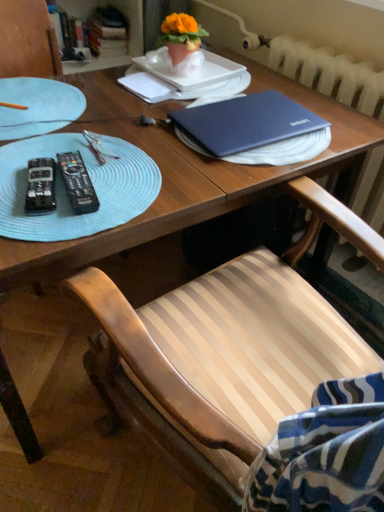
Where is `free space above light blue textured glass plate at left, the second glass plate when ordered from bottom to top (from a real-world perspective)`? The image size is (384, 512). free space above light blue textured glass plate at left, the second glass plate when ordered from bottom to top (from a real-world perspective) is located at coordinates (36, 103).